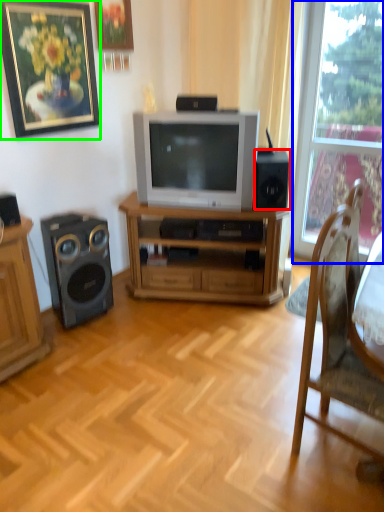
Question: Considering the real-world distances, which object is farthest from speaker (highlighted by a red box)? window (highlighted by a blue box) or picture frame (highlighted by a green box)?

Choices:
 (A) window
 (B) picture frame

Answer: (B)